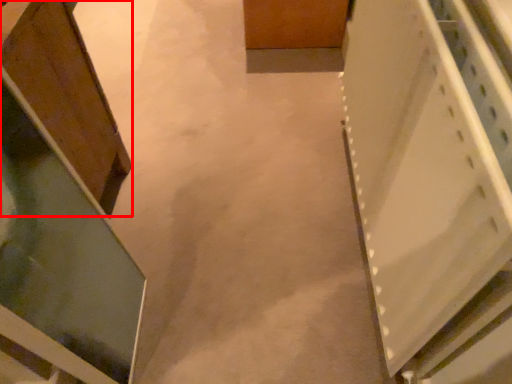
Question: From the image's perspective, what is the correct spatial relationship of cabinetry (annotated by the red box) in relation to cabinetry?

Choices:
 (A) above
 (B) below

Answer: (A)